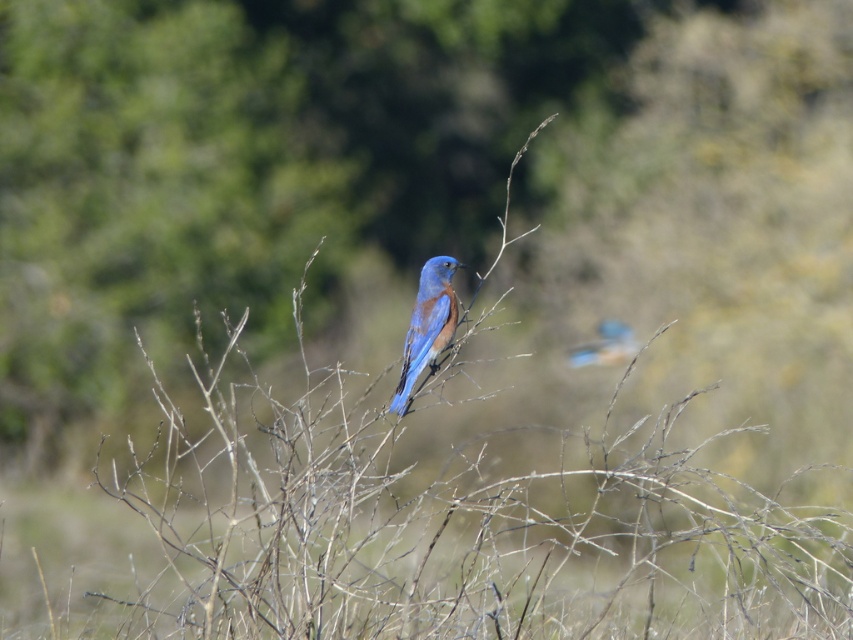
Which is below, blue glossy bird at center or blue glossy bird at upper right?

blue glossy bird at upper right is below.

Describe the element at coordinates (427, 324) in the screenshot. I see `blue glossy bird at center` at that location.

Which is in front, point (433, 289) or point (596, 324)?

Positioned in front is point (433, 289).

Find the location of `blue glossy bird at center`. blue glossy bird at center is located at coordinates (427, 324).